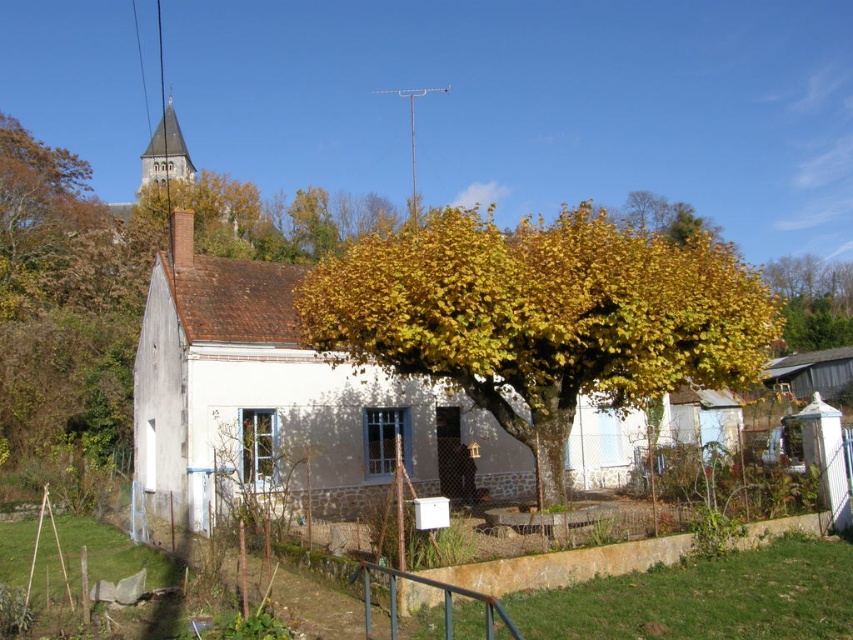
Question: From the image, what is the correct spatial relationship of white stone cottage at center in relation to yellow leafy tree at upper right?

Choices:
 (A) below
 (B) above

Answer: (A)

Question: Among these points, which one is farthest from the camera?

Choices:
 (A) (334, 336)
 (B) (325, 444)
 (C) (848, 356)
 (D) (770, 273)

Answer: (D)

Question: Can you confirm if golden leafy tree at center is positioned above white stone cottage at center?

Choices:
 (A) yes
 (B) no

Answer: (A)

Question: Which of the following is the farthest from the observer?

Choices:
 (A) brown wooden cottage at center-right
 (B) golden leafy tree at center
 (C) white stone cottage at center
 (D) yellow leafy tree at upper right

Answer: (D)

Question: Which object is the closest to the golden leafy tree at center?

Choices:
 (A) brown wooden cottage at center-right
 (B) white stone cottage at center
 (C) yellow leafy tree at upper right

Answer: (B)

Question: From the image, what is the correct spatial relationship of golden leafy tree at center in relation to brown wooden cottage at center-right?

Choices:
 (A) below
 (B) above

Answer: (B)